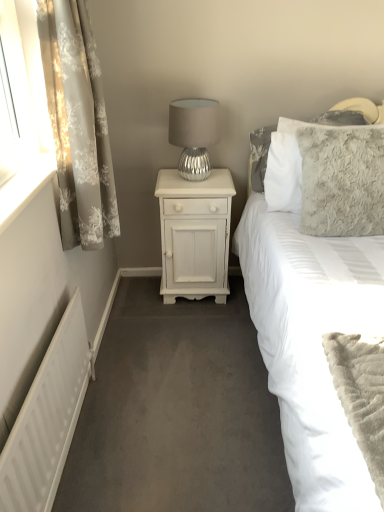
Describe the element at coordinates (47, 418) in the screenshot. The width and height of the screenshot is (384, 512). I see `white matte radiator at lower left` at that location.

I want to click on white painted wood nightstand at center, so click(195, 234).

Measure the distance between silver metallic table lamp at upper center and camera.

The depth of silver metallic table lamp at upper center is 6.55 feet.

At what (x,y) coordinates should I click in order to perform the action: click on fluffy gray pillow at upper right. Please return your answer as a coordinate pair (x, y). The image size is (384, 512). Looking at the image, I should click on (x=294, y=159).

What do you see at coordinates (311, 343) in the screenshot?
I see `fluffy gray pillow at upper right` at bounding box center [311, 343].

I want to click on white matte radiator at lower left, so click(x=47, y=418).

Is fluffy gray pillow at upper right inside or outside of white painted wood nightstand at center?

fluffy gray pillow at upper right is outside white painted wood nightstand at center.

Locate an element on the screen. This screenshot has width=384, height=512. pillow above the white painted wood nightstand at center (from a real-world perspective) is located at coordinates (294, 159).

Consider the image. Does fluffy gray pillow at upper right have a smaller size compared to white painted wood nightstand at center?

Indeed, fluffy gray pillow at upper right has a smaller size compared to white painted wood nightstand at center.

What's the angular difference between fluffy gray pillow at upper right and white painted wood nightstand at center's facing directions?

The angular difference between fluffy gray pillow at upper right and white painted wood nightstand at center is 2.7 degrees.

From a real-world perspective, is floral sheer curtain at left positioned over white matte radiator at lower left based on gravity?

Yes, from a real-world perspective, floral sheer curtain at left is above white matte radiator at lower left.

From the image's perspective, which object appears higher, floral sheer curtain at left or white matte radiator at lower left?

floral sheer curtain at left.

Considering the sizes of objects floral sheer curtain at left and white matte radiator at lower left in the image provided, who is thinner, floral sheer curtain at left or white matte radiator at lower left?

With smaller width is white matte radiator at lower left.

Between point (81, 243) and point (69, 443), which one is positioned behind?

The point (81, 243) is farther from the camera.

From the image's perspective, who appears lower, white painted wood nightstand at center or white matte radiator at lower left?

From the image's view, white matte radiator at lower left is below.

Can white matte radiator at lower left be found inside white painted wood nightstand at center?

Actually, white matte radiator at lower left is outside white painted wood nightstand at center.

Is white painted wood nightstand at center to the left of white matte radiator at lower left from the viewer's perspective?

No.

Who is bigger, white painted wood nightstand at center or white matte radiator at lower left?

Bigger between the two is white painted wood nightstand at center.

Does fluffy gray pillow at upper right have a lesser width compared to silver metallic table lamp at upper center?

In fact, fluffy gray pillow at upper right might be wider than silver metallic table lamp at upper center.

From the image's perspective, between fluffy gray pillow at upper right and silver metallic table lamp at upper center, who is located below?

fluffy gray pillow at upper right, from the image's perspective.

Does fluffy gray pillow at upper right appear on the left side of silver metallic table lamp at upper center?

No.

Considering the sizes of objects white painted wood nightstand at center and silver metallic table lamp at upper center in the image provided, who is shorter, white painted wood nightstand at center or silver metallic table lamp at upper center?

Standing shorter between the two is silver metallic table lamp at upper center.

From the image's perspective, is white painted wood nightstand at center positioned above or below silver metallic table lamp at upper center?

Based on their image positions, white painted wood nightstand at center is located beneath silver metallic table lamp at upper center.

Are white painted wood nightstand at center and silver metallic table lamp at upper center beside each other?

No.

Considering the positions of objects white painted wood nightstand at center and silver metallic table lamp at upper center in the image provided, who is more to the right, white painted wood nightstand at center or silver metallic table lamp at upper center?

Positioned to the right is white painted wood nightstand at center.

Which is more to the right, silver metallic table lamp at upper center or floral sheer curtain at left?

Positioned to the right is silver metallic table lamp at upper center.

From a real-world perspective, is silver metallic table lamp at upper center physically located above or below floral sheer curtain at left?

silver metallic table lamp at upper center is below floral sheer curtain at left.

Can we say silver metallic table lamp at upper center lies outside floral sheer curtain at left?

Yes, silver metallic table lamp at upper center is not within floral sheer curtain at left.

Between silver metallic table lamp at upper center and floral sheer curtain at left, which one has smaller size?

With smaller size is silver metallic table lamp at upper center.

Is silver metallic table lamp at upper center oriented away from fluffy gray pillow at upper right?

silver metallic table lamp at upper center does not have its back to fluffy gray pillow at upper right.

Are silver metallic table lamp at upper center and fluffy gray pillow at upper right far apart?

No, there isn't a large distance between silver metallic table lamp at upper center and fluffy gray pillow at upper right.

Who is bigger, silver metallic table lamp at upper center or fluffy gray pillow at upper right?

fluffy gray pillow at upper right.

This screenshot has height=512, width=384. In order to click on nightstand on the left side of fluffy gray pillow at upper right in this screenshot , I will do `click(195, 234)`.

You are a GUI agent. You are given a task and a screenshot of the screen. Output one action in this format:
    pyautogui.click(x=<x>, y=<y>)
    Task: Click on the curtain on the right of white matte radiator at lower left
    
    Given the screenshot: What is the action you would take?
    pyautogui.click(x=78, y=124)

Considering their positions, is fluffy gray pillow at upper right positioned further to fluffy gray pillow at upper right than white matte radiator at lower left?

Among the two, white matte radiator at lower left is located further to fluffy gray pillow at upper right.

Which object lies nearer to the anchor point fluffy gray pillow at upper right, white matte radiator at lower left or fluffy gray pillow at upper right?

fluffy gray pillow at upper right is positioned closer to the anchor fluffy gray pillow at upper right.

Estimate the real-world distances between objects in this image. Which object is further from floral sheer curtain at left, fluffy gray pillow at upper right or white painted wood nightstand at center?

fluffy gray pillow at upper right lies further to floral sheer curtain at left than the other object.

Looking at the image, which one is located closer to white painted wood nightstand at center, floral sheer curtain at left or white matte radiator at lower left?

The object closer to white painted wood nightstand at center is floral sheer curtain at left.

When comparing their distances from white painted wood nightstand at center, does fluffy gray pillow at upper right or white matte radiator at lower left seem further?

white matte radiator at lower left is positioned further to the anchor white painted wood nightstand at center.

Based on their spatial positions, is fluffy gray pillow at upper right or floral sheer curtain at left further from white matte radiator at lower left?

fluffy gray pillow at upper right lies further to white matte radiator at lower left than the other object.

From the image, which object appears to be nearer to fluffy gray pillow at upper right, white matte radiator at lower left or silver metallic table lamp at upper center?

silver metallic table lamp at upper center is closer to fluffy gray pillow at upper right.

Looking at the image, which one is located closer to floral sheer curtain at left, fluffy gray pillow at upper right or silver metallic table lamp at upper center?

Based on the image, silver metallic table lamp at upper center appears to be nearer to floral sheer curtain at left.

The image size is (384, 512). What are the coordinates of `curtain positioned between white matte radiator at lower left and white painted wood nightstand at center from near to far` in the screenshot? It's located at (78, 124).

At what (x,y) coordinates should I click in order to perform the action: click on pillow between white matte radiator at lower left and white painted wood nightstand at center in the front-back direction. Please return your answer as a coordinate pair (x, y). Image resolution: width=384 pixels, height=512 pixels. Looking at the image, I should click on (294, 159).

Where is `nightstand situated between floral sheer curtain at left and fluffy gray pillow at upper right from left to right`? nightstand situated between floral sheer curtain at left and fluffy gray pillow at upper right from left to right is located at coordinates (195, 234).

I want to click on table lamp between fluffy gray pillow at upper right and fluffy gray pillow at upper right from front to back, so click(x=194, y=134).